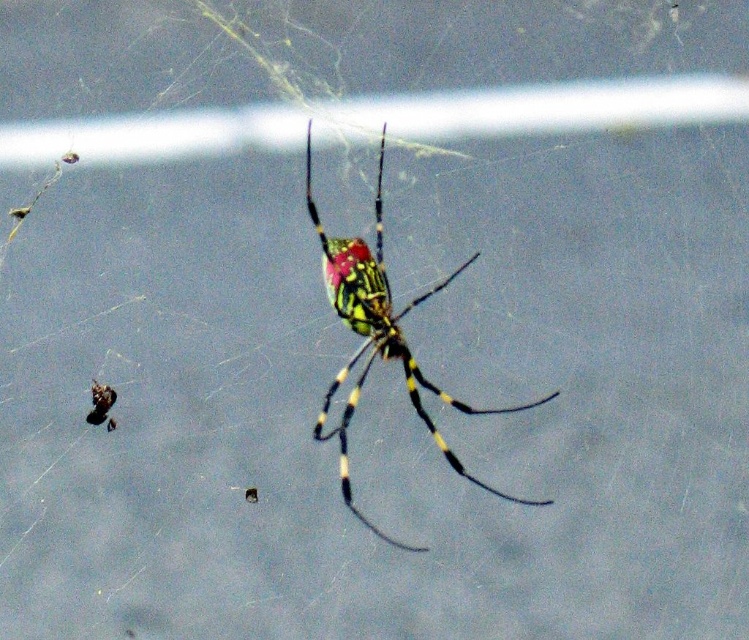
Which is above, multicolored glossy spider at center or shiny black insect at lower left?

Positioned higher is multicolored glossy spider at center.

Measure the distance from multicolored glossy spider at center to shiny black insect at lower left.

multicolored glossy spider at center is 28.13 inches from shiny black insect at lower left.

Does point (374, 227) come in front of point (112, 424)?

No.

Identify the location of multicolored glossy spider at center. The width and height of the screenshot is (749, 640). (379, 337).